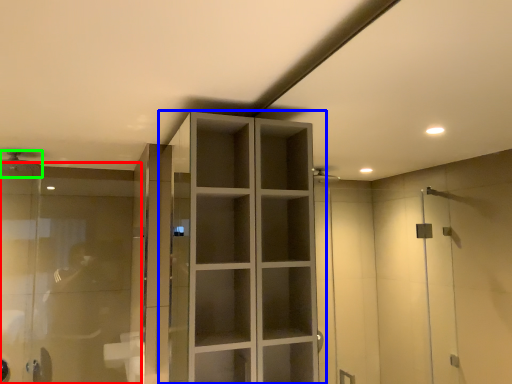
Question: Based on their relative distances, which object is nearer to glass door (highlighted by a red box)? Choose from cupboard (highlighted by a blue box) and shower (highlighted by a green box).

Choices:
 (A) cupboard
 (B) shower

Answer: (B)